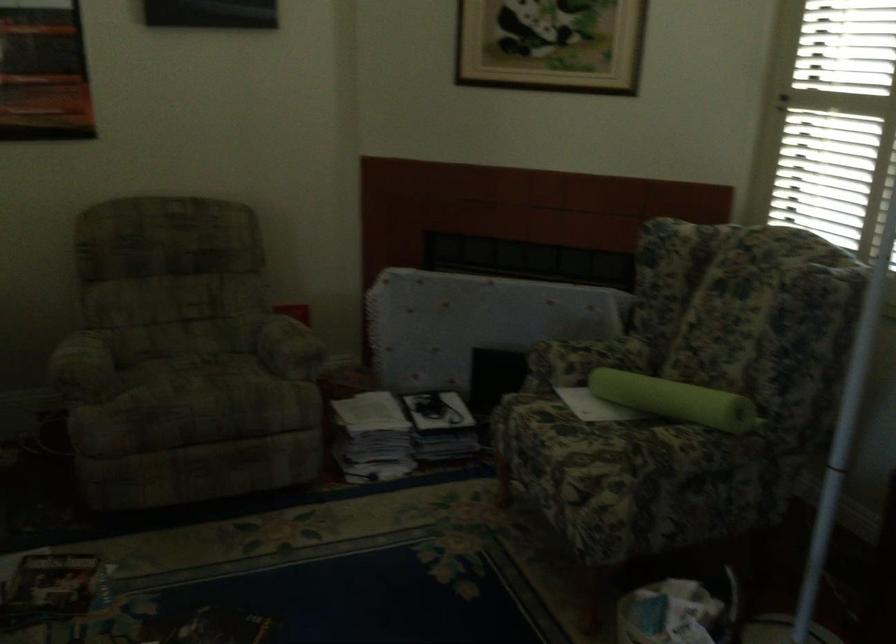
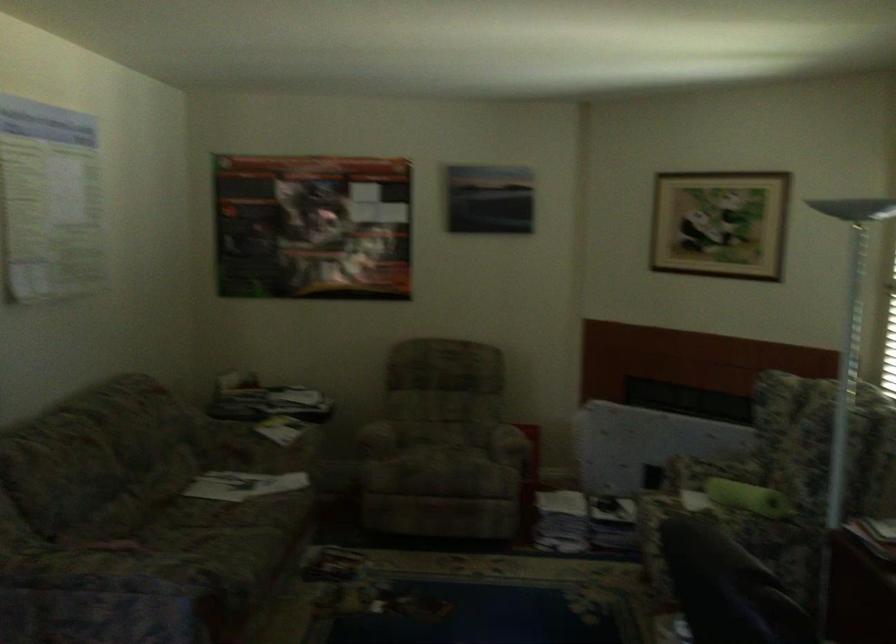
Locate, in the second image, the point that corresponds to (x=88, y=365) in the first image.

(377, 438)